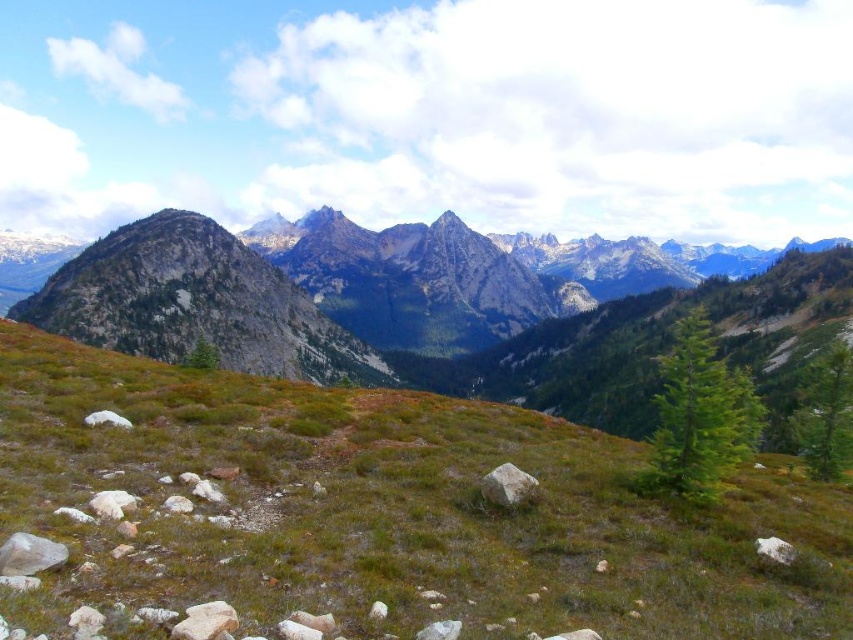
You are a hiker who wants to place a small flag on the highest point between the green grassy at center and the white smooth rock at lower left. Which object should you choose to place the flag on?

The green grassy at center has a greater height compared to the white smooth rock at lower left, so you should place the flag on the green grassy at center.

You are standing on the grassy hillside and see the gray rough rock at lower left and the white smooth rock at lower left. Which rock is closer to the ground?

The gray rough rock at lower left is located below the white smooth rock at lower left, so it is closer to the ground.

You are a geologist examining the rocks in the foreground of the mountain landscape. You notice the gray rough rock at lower left and the white smooth rock at lower left. Which rock is taller?

The gray rough rock at lower left is much taller than the white smooth rock at lower left.